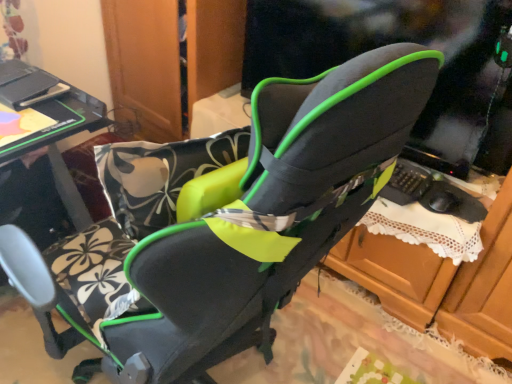
Measure the distance between point (49, 85) and camera.

Point (49, 85) and camera are 1.34 meters apart.

What do you see at coordinates (51, 125) in the screenshot? This screenshot has height=384, width=512. I see `black glossy table at left` at bounding box center [51, 125].

You are a GUI agent. You are given a task and a screenshot of the screen. Output one action in this format:
    pyautogui.click(x=<x>, y=<y>)
    Task: Click on the black glossy table at left
    
    Given the screenshot: What is the action you would take?
    pyautogui.click(x=51, y=125)

This screenshot has width=512, height=384. What do you see at coordinates (146, 63) in the screenshot? I see `black fabric dresser at center` at bounding box center [146, 63].

Where is `black fabric dresser at center`? black fabric dresser at center is located at coordinates [146, 63].

Where is `black glossy table at left`? The width and height of the screenshot is (512, 384). black glossy table at left is located at coordinates (51, 125).

Considering the positions of objects black glossy table at left and black fabric dresser at center in the image provided, who is more to the right, black glossy table at left or black fabric dresser at center?

black fabric dresser at center.

Considering their positions, is black glossy table at left located in front of or behind black fabric dresser at center?

Clearly, black glossy table at left is in front of black fabric dresser at center.

Is point (77, 228) behind point (168, 55)?

No.

Looking at this image, from the image's perspective, is black glossy table at left over black fabric dresser at center?

No, from the image's perspective, black glossy table at left is not above black fabric dresser at center.

From a real-world perspective, is black glossy table at left physically located above or below black fabric dresser at center?

black glossy table at left is situated higher than black fabric dresser at center in the real world.

Can you confirm if black glossy table at left is thinner than black fabric dresser at center?

Indeed, black glossy table at left has a lesser width compared to black fabric dresser at center.

Is black glossy table at left taller than black fabric dresser at center?

Indeed, black glossy table at left has a greater height compared to black fabric dresser at center.

Considering the sizes of black glossy table at left and black fabric dresser at center in the image, is black glossy table at left bigger or smaller than black fabric dresser at center?

Clearly, black glossy table at left is smaller in size than black fabric dresser at center.

Looking at this image, does black glossy table at left contain black fabric dresser at center?

That's incorrect, black fabric dresser at center is not inside black glossy table at left.

Based on the photo, is black glossy table at left with black fabric dresser at center?

No, black glossy table at left is not making contact with black fabric dresser at center.

Looking at this image, could you tell me if black glossy table at left is facing black fabric dresser at center?

No, black glossy table at left is not oriented towards black fabric dresser at center.

How different are the orientations of black glossy table at left and black fabric dresser at center in degrees?

The facing directions of black glossy table at left and black fabric dresser at center are 92.7 degrees apart.

Identify the location of dresser above the black glossy table at left (from the image's perspective). (146, 63).

Consider the image. Considering the relative positions of black fabric dresser at center and black glossy table at left in the image provided, is black fabric dresser at center to the left of black glossy table at left from the viewer's perspective?

No, black fabric dresser at center is not to the left of black glossy table at left.

Is black fabric dresser at center closer to camera compared to black glossy table at left?

No, black fabric dresser at center is behind black glossy table at left.

Is point (105, 30) less distant than point (89, 130)?

No.

From the image's perspective, is black fabric dresser at center located beneath black glossy table at left?

No, from the image's perspective, black fabric dresser at center is not beneath black glossy table at left.

From a real-world perspective, which object rests below the other?

black fabric dresser at center.

Which of these two, black fabric dresser at center or black glossy table at left, is wider?

Wider between the two is black fabric dresser at center.

Between black fabric dresser at center and black glossy table at left, which one has less height?

black fabric dresser at center is shorter.

Is black fabric dresser at center smaller than black glossy table at left?

No, black fabric dresser at center is not smaller than black glossy table at left.

Would you say black fabric dresser at center is inside or outside black glossy table at left?

black fabric dresser at center is located beyond the bounds of black glossy table at left.

Is there a large distance between black fabric dresser at center and black glossy table at left?

black fabric dresser at center is near black glossy table at left, not far away.

Is black fabric dresser at center oriented towards black glossy table at left?

Yes, black fabric dresser at center is turned towards black glossy table at left.

How many degrees apart are the facing directions of black fabric dresser at center and black glossy table at left?

The angular difference between black fabric dresser at center and black glossy table at left is 92.7 degrees.

Measure the distance between black fabric dresser at center and black glossy table at left.

They are 23.39 inches apart.

The height and width of the screenshot is (384, 512). In the image, there is a black fabric dresser at center. Identify the location of table below it (from the image's perspective). pyautogui.click(x=51, y=125).

Where is `dresser on the right of black glossy table at left`? This screenshot has height=384, width=512. dresser on the right of black glossy table at left is located at coordinates (146, 63).

Find the location of `dresser below the black glossy table at left (from a real-world perspective)`. dresser below the black glossy table at left (from a real-world perspective) is located at coordinates (146, 63).